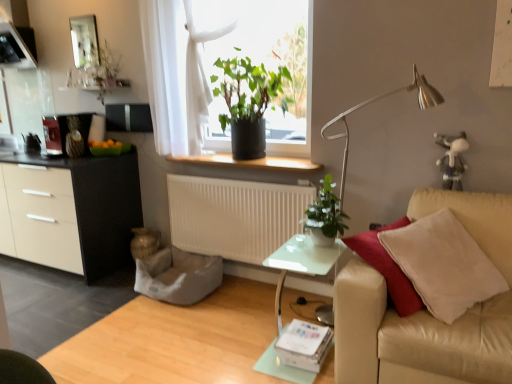
The image size is (512, 384). What are the coordinates of `matte black cabinet at left` in the screenshot? It's located at (73, 211).

Measure the distance between white matte radiator at center and camera.

white matte radiator at center is 2.74 meters from camera.

Describe the element at coordinates (234, 216) in the screenshot. I see `white matte radiator at center` at that location.

This screenshot has height=384, width=512. What do you see at coordinates (174, 340) in the screenshot?
I see `smooth beige couch at right` at bounding box center [174, 340].

Describe the element at coordinates (227, 72) in the screenshot. I see `green leafy plant at center` at that location.

Describe the element at coordinates (428, 312) in the screenshot. I see `beige leather couch at right` at that location.

Where is `matte black cabinet at left`? This screenshot has width=512, height=384. matte black cabinet at left is located at coordinates (73, 211).

Find the location of a particular element. The image size is (512, 384). cabinetry that is behind the beige leather couch at right is located at coordinates (73, 211).

In the image, is matte black cabinet at left on the left side or the right side of beige leather couch at right?

matte black cabinet at left is positioned on beige leather couch at right's left side.

Is matte black cabinet at left oriented towards beige leather couch at right?

No, matte black cabinet at left is not aimed at beige leather couch at right.

From a real-world perspective, who is located higher, matte black cabinet at left or beige leather couch at right?

matte black cabinet at left is physically above.

Considering the relative sizes of gray fabric swivel chair at lower center and beige leather couch at right in the image provided, is gray fabric swivel chair at lower center smaller than beige leather couch at right?

Yes.

Considering the relative sizes of gray fabric swivel chair at lower center and beige leather couch at right in the image provided, is gray fabric swivel chair at lower center thinner than beige leather couch at right?

Indeed, gray fabric swivel chair at lower center has a lesser width compared to beige leather couch at right.

Considering the relative positions of gray fabric swivel chair at lower center and beige leather couch at right in the image provided, is gray fabric swivel chair at lower center behind beige leather couch at right?

Yes, the depth of gray fabric swivel chair at lower center is greater than that of beige leather couch at right.

Would you consider gray fabric swivel chair at lower center to be distant from beige leather couch at right?

Absolutely, gray fabric swivel chair at lower center is distant from beige leather couch at right.

From a real-world perspective, which is physically below, green leafy plant at center or green matte plant at center, which is counted as the 2th houseplant, starting from the top?

In real-world perspective, green matte plant at center, which is counted as the 2th houseplant, starting from the top, is lower.

Considering the relative positions of green leafy plant at center and green matte plant at center, the second houseplant from the left, in the image provided, is green leafy plant at center in front of green matte plant at center, the second houseplant from the left,?

No, the depth of green leafy plant at center is greater than that of green matte plant at center, the second houseplant from the left.

From the image's perspective, is green leafy plant at center above green matte plant at center, which is counted as the 2th houseplant, starting from the top?

Yes, from the image's perspective, green leafy plant at center is on top of green matte plant at center, which is counted as the 2th houseplant, starting from the top.

Is green leafy plant at center not near green matte plant at center, marked as the 1th houseplant in a right-to-left arrangement?

Yes, green leafy plant at center and green matte plant at center, marked as the 1th houseplant in a right-to-left arrangement, are quite far apart.

Considering the points (271, 156) and (250, 280), which point is in front, point (271, 156) or point (250, 280)?

The point (271, 156) is in front.

From a real-world perspective, is black plastic window sill at center above or below smooth beige couch at right?

In terms of real-world spatial position, black plastic window sill at center is above smooth beige couch at right.

Considering the relative sizes of black plastic window sill at center and smooth beige couch at right in the image provided, is black plastic window sill at center taller than smooth beige couch at right?

No, black plastic window sill at center is not taller than smooth beige couch at right.

Which of these two, green leafy plant at center or gray fabric swivel chair at lower center, is bigger?

Bigger between the two is green leafy plant at center.

Is green leafy plant at center oriented towards gray fabric swivel chair at lower center?

No, green leafy plant at center is not oriented towards gray fabric swivel chair at lower center.

Considering the sizes of green leafy plant at center and gray fabric swivel chair at lower center in the image, is green leafy plant at center wider or thinner than gray fabric swivel chair at lower center?

Considering their sizes, green leafy plant at center looks slimmer than gray fabric swivel chair at lower center.

Which point is more distant from viewer, (295,262) or (85,49)?

The point (85,49) is more distant.

Find the location of a particular element. table located underneath the matte silver mirror at upper left (from a real-world perspective) is located at coordinates (302, 263).

How different are the orientations of clear glass table at center and matte silver mirror at upper left in degrees?

They differ by 0.252 degrees in their facing directions.

Is clear glass table at center to the right of matte silver mirror at upper left from the viewer's perspective?

Indeed, clear glass table at center is positioned on the right side of matte silver mirror at upper left.

In the scene shown: Is smooth beige couch at right spatially inside white matte radiator at center, or outside of it?

smooth beige couch at right is not inside white matte radiator at center, it's outside.

From a real-world perspective, is smooth beige couch at right on top of white matte radiator at center?

No, from a real-world perspective, smooth beige couch at right is not above white matte radiator at center.

Considering the positions of points (329, 377) and (268, 238), is point (329, 377) closer to camera compared to point (268, 238)?

That is True.

Image resolution: width=512 pixels, height=384 pixels. In order to click on cabinetry that is above the beige leather couch at right (from the image's perspective) in this screenshot , I will do `click(73, 211)`.

You are a GUI agent. You are given a task and a screenshot of the screen. Output one action in this format:
    pyautogui.click(x=<x>, y=<y>)
    Task: Click on the swivel chair below the beige leather couch at right (from a real-world perspective)
    
    Given the screenshot: What is the action you would take?
    pyautogui.click(x=173, y=271)

Consider the image. Based on their spatial positions, is smooth beige couch at right or silver metallic floor lamp at right closer to white matte radiator at center?

smooth beige couch at right.

Considering their positions, is green matte plant at upper center, the 1th houseplant positioned from the back, positioned further to black plastic window sill at center than gray fabric swivel chair at lower center?

The object further to black plastic window sill at center is gray fabric swivel chair at lower center.

Considering their positions, is matte black cabinet at left positioned closer to green matte plant at center, which is counted as the 2th houseplant, starting from the top, than black plastic window sill at center?

black plastic window sill at center.

Estimate the real-world distances between objects in this image. Which object is further from transparent glass door at left, green leafy plant at center or clear glass table at center?

Based on the image, clear glass table at center appears to be further to transparent glass door at left.

Considering their positions, is matte silver mirror at upper left positioned further to matte black cabinet at left than smooth beige couch at right?

Based on the image, matte silver mirror at upper left appears to be further to matte black cabinet at left.

Based on their spatial positions, is matte black cabinet at left or transparent glass door at left closer to beige leather couch at right?

Among the two, matte black cabinet at left is located nearer to beige leather couch at right.

Based on their spatial positions, is black plastic window sill at center or gray fabric swivel chair at lower center further from transparent glass door at left?

black plastic window sill at center is further to transparent glass door at left.

When comparing their distances from silver metallic floor lamp at right, does matte silver mirror at upper left or transparent glass door at left seem closer?

Based on the image, matte silver mirror at upper left appears to be nearer to silver metallic floor lamp at right.

Identify the location of swivel chair between green matte plant at upper center, marked as the first houseplant in a top-to-bottom arrangement, and clear glass table at center, in the vertical direction. (173, 271).

You are a GUI agent. You are given a task and a screenshot of the screen. Output one action in this format:
    pyautogui.click(x=<x>, y=<y>)
    Task: Click on the mirror located between transparent glass door at left and green matte plant at upper center, marked as the first houseplant in a top-to-bottom arrangement, in the left-right direction
    The image size is (512, 384).
    Given the screenshot: What is the action you would take?
    pyautogui.click(x=84, y=40)

This screenshot has width=512, height=384. I want to click on radiator that lies between green leafy plant at center and gray fabric swivel chair at lower center from top to bottom, so click(234, 216).

Where is `radiator located between smooth beige couch at right and silver metallic floor lamp at right in the left-right direction`? This screenshot has height=384, width=512. radiator located between smooth beige couch at right and silver metallic floor lamp at right in the left-right direction is located at coordinates (234, 216).